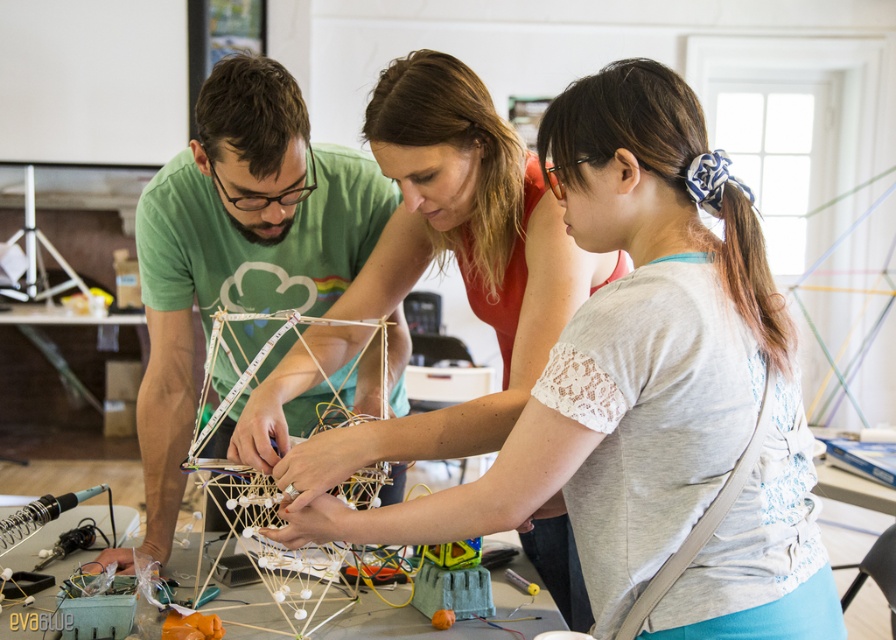
Which of these two, white lace shirt at center or green matte shirt at center, stands shorter?

white lace shirt at center is shorter.

How far apart are white lace shirt at center and green matte shirt at center?

white lace shirt at center and green matte shirt at center are 22.59 inches apart from each other.

I want to click on white lace shirt at center, so click(648, 392).